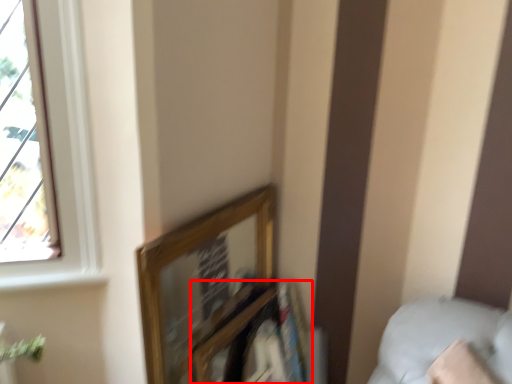
Question: From the image's perspective, what is the correct spatial relationship of shelf (annotated by the red box) in relation to pillow?

Choices:
 (A) above
 (B) below

Answer: (B)